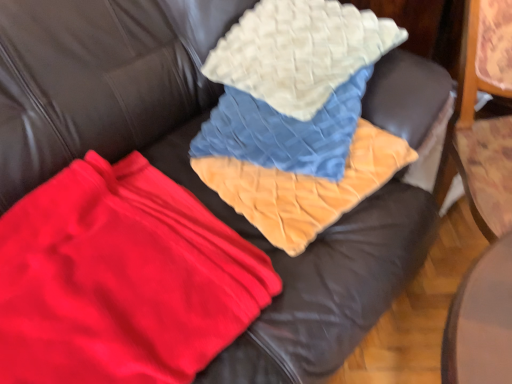
Question: Is white quilted pillow at upper center located within red fleece blanket at center?

Choices:
 (A) yes
 (B) no

Answer: (B)

Question: Considering the relative sizes of red fleece blanket at center and white quilted pillow at upper center in the image provided, is red fleece blanket at center bigger than white quilted pillow at upper center?

Choices:
 (A) no
 (B) yes

Answer: (A)

Question: From a real-world perspective, is red fleece blanket at center over white quilted pillow at upper center?

Choices:
 (A) yes
 (B) no

Answer: (B)

Question: Does red fleece blanket at center turn towards white quilted pillow at upper center?

Choices:
 (A) yes
 (B) no

Answer: (B)

Question: Is red fleece blanket at center directly adjacent to white quilted pillow at upper center?

Choices:
 (A) yes
 (B) no

Answer: (B)

Question: From a real-world perspective, is velvet orange blanket at center physically located above or below red fleece blanket at center?

Choices:
 (A) below
 (B) above

Answer: (B)

Question: Is velvet orange blanket at center wider or thinner than red fleece blanket at center?

Choices:
 (A) thin
 (B) wide

Answer: (A)

Question: Based on their sizes in the image, would you say velvet orange blanket at center is bigger or smaller than red fleece blanket at center?

Choices:
 (A) big
 (B) small

Answer: (B)

Question: Considering the relative positions of velvet orange blanket at center and red fleece blanket at center in the image provided, is velvet orange blanket at center to the left or to the right of red fleece blanket at center?

Choices:
 (A) right
 (B) left

Answer: (A)

Question: Based on their sizes in the image, would you say red fleece blanket at center is bigger or smaller than velvet orange blanket at center?

Choices:
 (A) big
 (B) small

Answer: (A)

Question: In terms of height, does red fleece blanket at center look taller or shorter compared to velvet orange blanket at center?

Choices:
 (A) short
 (B) tall

Answer: (A)

Question: Do you think red fleece blanket at center is within velvet orange blanket at center, or outside of it?

Choices:
 (A) inside
 (B) outside

Answer: (B)

Question: Is red fleece blanket at center wider or thinner than velvet orange blanket at center?

Choices:
 (A) thin
 (B) wide

Answer: (B)

Question: Is velvet orange blanket at center situated inside white quilted pillow at upper center or outside?

Choices:
 (A) outside
 (B) inside

Answer: (A)

Question: In terms of width, does velvet orange blanket at center look wider or thinner when compared to white quilted pillow at upper center?

Choices:
 (A) thin
 (B) wide

Answer: (B)